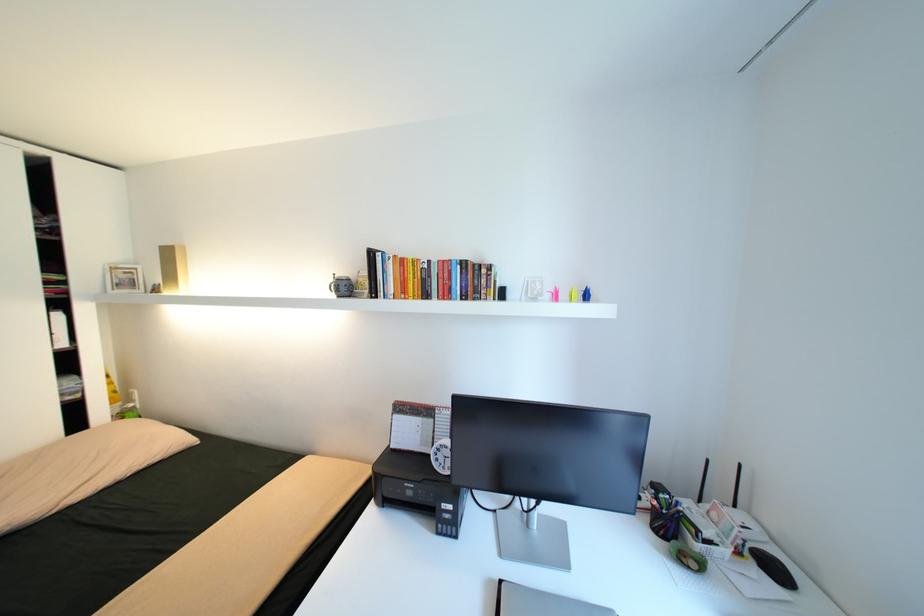
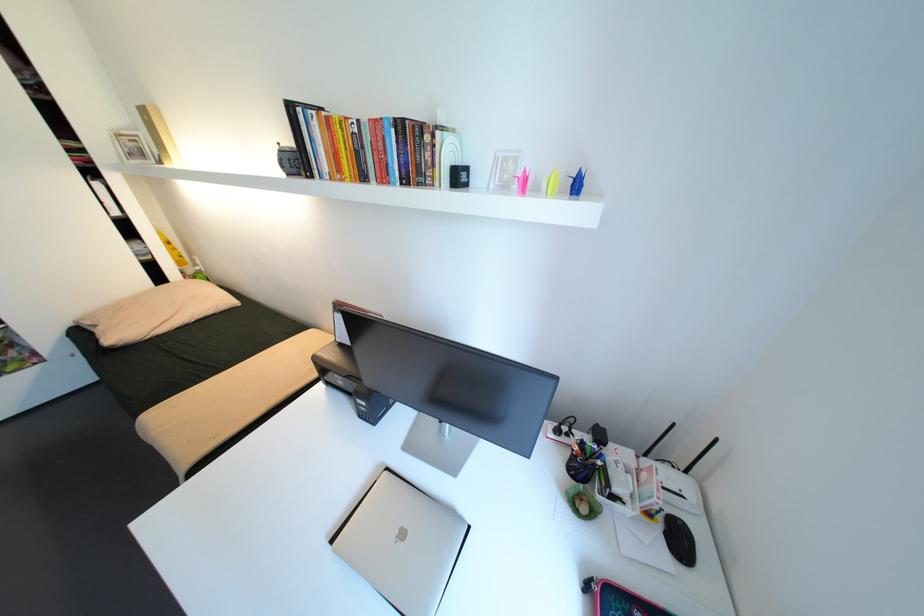
Question: The images are taken continuously from a first-person perspective. In which direction is your viewpoint rotating?

Choices:
 (A) Left
 (B) Right
 (C) Up
 (D) Down

Answer: (D)